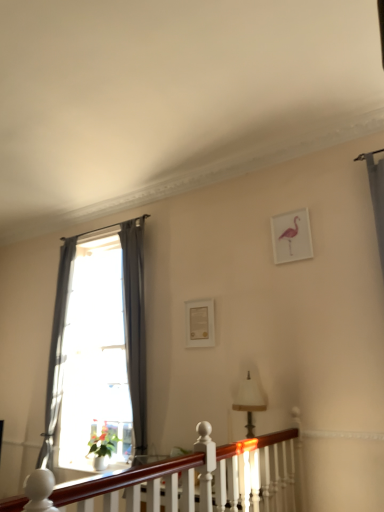
Question: From a real-world perspective, is mahogany wood balustrade at lower center beneath white fabric lampshade at center?

Choices:
 (A) no
 (B) yes

Answer: (B)

Question: Considering the relative sizes of mahogany wood balustrade at lower center and white fabric lampshade at center in the image provided, is mahogany wood balustrade at lower center wider than white fabric lampshade at center?

Choices:
 (A) no
 (B) yes

Answer: (A)

Question: Does mahogany wood balustrade at lower center have a smaller size compared to white fabric lampshade at center?

Choices:
 (A) no
 (B) yes

Answer: (A)

Question: Is mahogany wood balustrade at lower center shorter than white fabric lampshade at center?

Choices:
 (A) no
 (B) yes

Answer: (A)

Question: Could you tell me if mahogany wood balustrade at lower center is facing white fabric lampshade at center?

Choices:
 (A) no
 (B) yes

Answer: (A)

Question: Considering the relative positions of mahogany wood balustrade at lower center and white fabric lampshade at center in the image provided, is mahogany wood balustrade at lower center in front of white fabric lampshade at center?

Choices:
 (A) no
 (B) yes

Answer: (B)

Question: From a real-world perspective, is gray fabric curtain at left, which is counted as the 2th curtain, starting from the left, over gray fabric curtain at left, the second curtain in the right-to-left sequence?

Choices:
 (A) no
 (B) yes

Answer: (B)

Question: Considering the relative sizes of gray fabric curtain at left, acting as the 1th curtain starting from the right, and gray fabric curtain at left, the 1th curtain when ordered from left to right, in the image provided, is gray fabric curtain at left, acting as the 1th curtain starting from the right, bigger than gray fabric curtain at left, the 1th curtain when ordered from left to right,?

Choices:
 (A) yes
 (B) no

Answer: (B)

Question: Is gray fabric curtain at left, which is counted as the 2th curtain, starting from the left, far from gray fabric curtain at left, the second curtain in the right-to-left sequence?

Choices:
 (A) no
 (B) yes

Answer: (B)

Question: Considering the relative positions of gray fabric curtain at left, which is counted as the 2th curtain, starting from the left, and gray fabric curtain at left, the second curtain in the right-to-left sequence, in the image provided, is gray fabric curtain at left, which is counted as the 2th curtain, starting from the left, to the left of gray fabric curtain at left, the second curtain in the right-to-left sequence, from the viewer's perspective?

Choices:
 (A) yes
 (B) no

Answer: (B)

Question: Could you tell me if gray fabric curtain at left, acting as the 1th curtain starting from the right, is facing gray fabric curtain at left, the 1th curtain when ordered from left to right?

Choices:
 (A) yes
 (B) no

Answer: (B)

Question: Is gray fabric curtain at left, acting as the 1th curtain starting from the right, with gray fabric curtain at left, the second curtain in the right-to-left sequence?

Choices:
 (A) no
 (B) yes

Answer: (A)

Question: Is mahogany wood balustrade at lower center to the left of pink matte picture frame at upper right, the 1th picture frame in the front-to-back sequence, from the viewer's perspective?

Choices:
 (A) no
 (B) yes

Answer: (B)